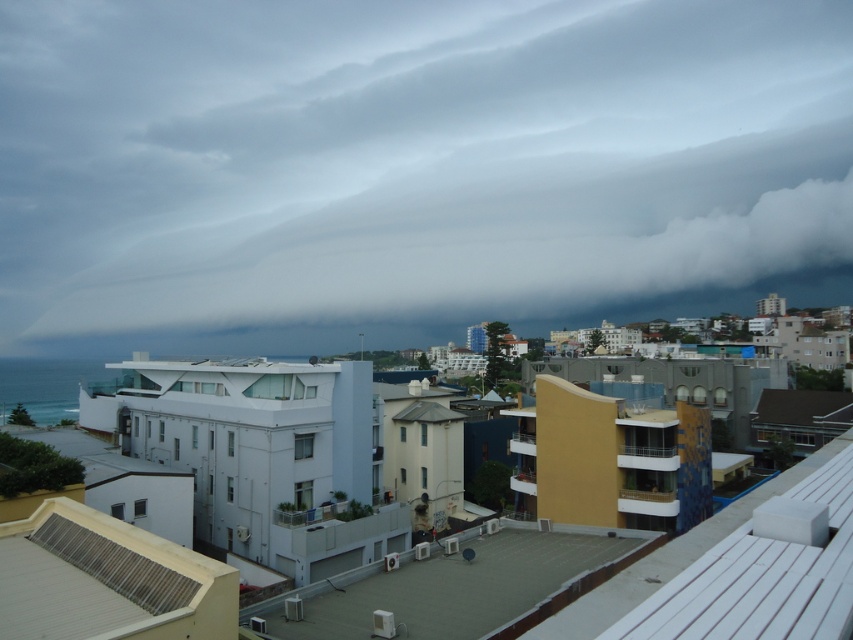
Question: Does gray cloud at upper center have a smaller size compared to white concrete balcony at center?

Choices:
 (A) no
 (B) yes

Answer: (A)

Question: Which object is farther from the camera taking this photo?

Choices:
 (A) white concrete balcony at center
 (B) gray cloud at upper center

Answer: (B)

Question: Is gray cloud at upper center to the left of white concrete balcony at center from the viewer's perspective?

Choices:
 (A) yes
 (B) no

Answer: (B)

Question: Is gray cloud at upper center bigger than white concrete balcony at center?

Choices:
 (A) yes
 (B) no

Answer: (A)